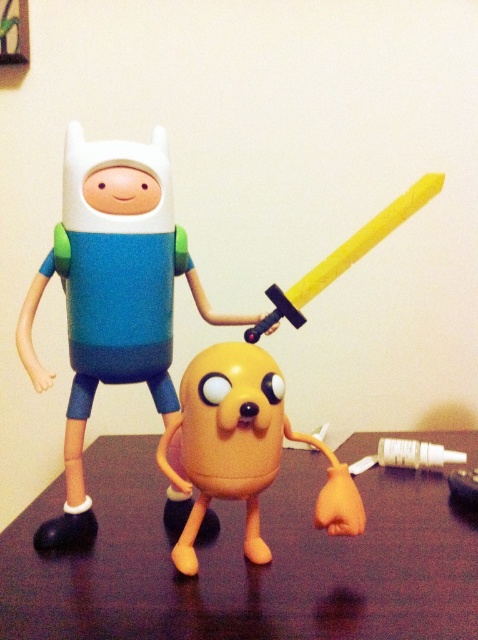
Measure the distance between point (72,417) and camera.

They are 79.08 centimeters apart.

Is matte plastic figure at center taller than orange matte/jellybean at center?

Correct, matte plastic figure at center is much taller as orange matte/jellybean at center.

Does point (65, 276) come farther from viewer compared to point (341, 513)?

Yes, point (65, 276) is farther from viewer.

The width and height of the screenshot is (478, 640). Identify the location of matte plastic figure at center. (102, 300).

Between point (368, 532) and point (326, 502), which one is positioned in front?

Point (326, 502)

Is point (141, 556) positioned before point (178, 557)?

No, (141, 556) is behind (178, 557).

Between point (151, 436) and point (177, 541), which one is positioned in front?

Point (177, 541) is more forward.

You are a GUI agent. You are given a task and a screenshot of the screen. Output one action in this format:
    pyautogui.click(x=<x>, y=<y>)
    Task: Click on the brown wooden table at center
    The width and height of the screenshot is (478, 640).
    Given the screenshot: What is the action you would take?
    pyautogui.click(x=246, y=561)

Does brown wooden table at center have a smaller size compared to matte plastic figure at center?

No, brown wooden table at center is not smaller than matte plastic figure at center.

Which is in front, point (8, 600) or point (41, 275)?

Point (8, 600)

Measure the distance between brown wooden table at center and camera.

brown wooden table at center is 23.30 inches away from camera.

This screenshot has width=478, height=640. Identify the location of brown wooden table at center. (246, 561).